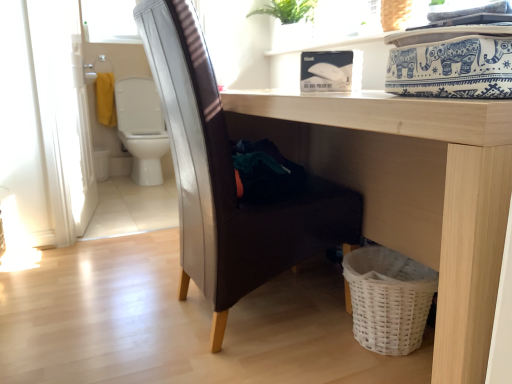
Question: Is light wood table at lower center a part of leather-like brown chair at center?

Choices:
 (A) yes
 (B) no

Answer: (B)

Question: Is leather-like brown chair at center bigger than light wood table at lower center?

Choices:
 (A) yes
 (B) no

Answer: (B)

Question: Does leather-like brown chair at center come behind light wood table at lower center?

Choices:
 (A) yes
 (B) no

Answer: (A)

Question: Is leather-like brown chair at center thinner than light wood table at lower center?

Choices:
 (A) no
 (B) yes

Answer: (B)

Question: Could you tell me if leather-like brown chair at center is turned towards light wood table at lower center?

Choices:
 (A) yes
 (B) no

Answer: (A)

Question: Visually, is transparent glass window screen at upper left positioned to the left or to the right of white glossy screen door at left?

Choices:
 (A) right
 (B) left

Answer: (B)

Question: Is point (92, 3) positioned closer to the camera than point (59, 241)?

Choices:
 (A) closer
 (B) farther

Answer: (B)

Question: Is transparent glass window screen at upper left wider or thinner than white glossy screen door at left?

Choices:
 (A) wide
 (B) thin

Answer: (A)

Question: In the image, is transparent glass window screen at upper left positioned in front of or behind white glossy screen door at left?

Choices:
 (A) behind
 (B) front

Answer: (A)

Question: From a real-world perspective, is white glossy screen door at left above or below light wood table at lower center?

Choices:
 (A) above
 (B) below

Answer: (A)

Question: In terms of width, does white glossy screen door at left look wider or thinner when compared to light wood table at lower center?

Choices:
 (A) thin
 (B) wide

Answer: (A)

Question: Considering the relative positions of white glossy screen door at left and light wood table at lower center in the image provided, is white glossy screen door at left to the left or to the right of light wood table at lower center?

Choices:
 (A) right
 (B) left

Answer: (B)

Question: Looking at the image, does white glossy screen door at left seem bigger or smaller compared to light wood table at lower center?

Choices:
 (A) big
 (B) small

Answer: (B)

Question: Is white glossy screen door at left in front of or behind leather-like brown chair at center in the image?

Choices:
 (A) front
 (B) behind

Answer: (B)

Question: Is white glossy screen door at left inside the boundaries of leather-like brown chair at center, or outside?

Choices:
 (A) outside
 (B) inside

Answer: (A)